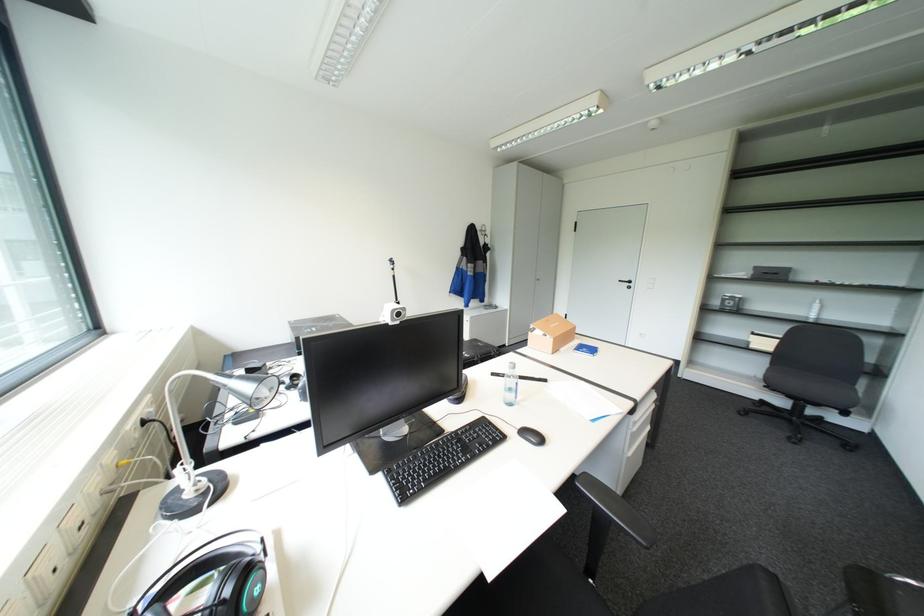
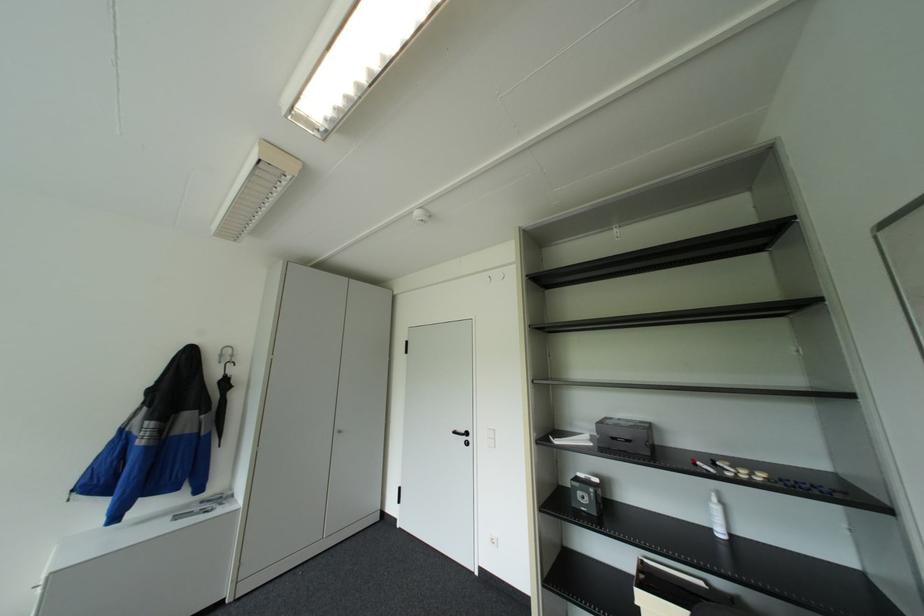
Where in the second image is the point corresponding to point 755,276 from the first image?

(600, 443)